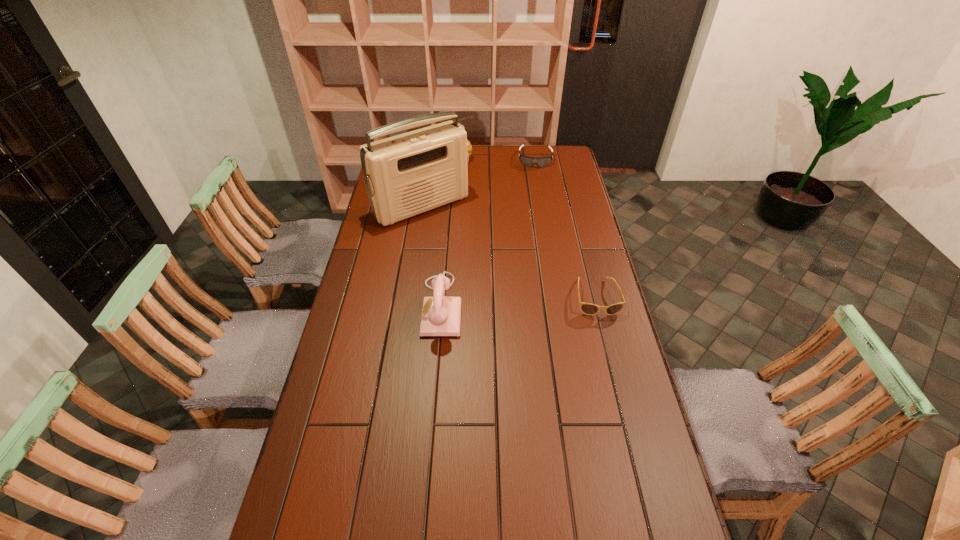
The height and width of the screenshot is (540, 960). I want to click on vacant space located 0.230m on the front and sides of the goggles, so click(x=534, y=196).

Locate an element on the screen. This screenshot has height=540, width=960. vacant point located 0.050m on the front and sides of the goggles is located at coordinates (535, 174).

I want to click on free space located 0.260m on the front and sides of the goggles, so (534, 200).

Identify the location of vacant space located 0.180m on the front-facing side of the tallest object. The width and height of the screenshot is (960, 540). (468, 249).

This screenshot has width=960, height=540. What are the coordinates of `vacant space located 0.400m on the front-facing side of the tallest object` in the screenshot? It's located at (500, 283).

The height and width of the screenshot is (540, 960). Find the location of `free space located on the front-facing side of the tallest object`. free space located on the front-facing side of the tallest object is located at coordinates (484, 265).

Locate an element on the screen. vacant space located 0.120m on the stem side of the gourd is located at coordinates (467, 181).

The width and height of the screenshot is (960, 540). Find the location of `free location located 0.050m on the stem side of the gourd`. free location located 0.050m on the stem side of the gourd is located at coordinates (464, 173).

Identify the location of vacant area situated on the stem side of the gourd. The image size is (960, 540). (472, 199).

Locate an element on the screen. This screenshot has height=540, width=960. goggles located at the far edge is located at coordinates (528, 161).